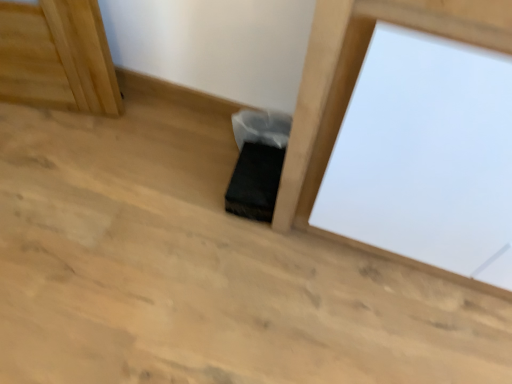
Locate an element on the screen. white matte screen door at center is located at coordinates (426, 156).

The width and height of the screenshot is (512, 384). What do you see at coordinates (426, 156) in the screenshot?
I see `white matte screen door at center` at bounding box center [426, 156].

The image size is (512, 384). I want to click on white matte screen door at center, so click(426, 156).